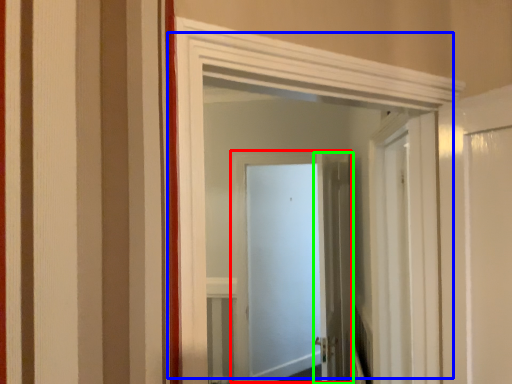
Question: Based on their relative distances, which object is nearer to door (highlighted by a red box)? Choose from door (highlighted by a blue box) and door (highlighted by a green box).

Choices:
 (A) door
 (B) door

Answer: (B)